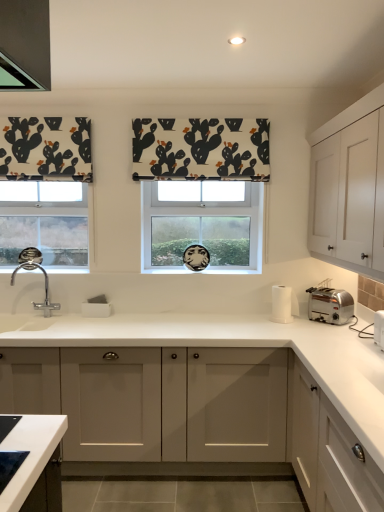
This screenshot has height=512, width=384. Identify the location of vacant area situated below chrome metallic sink at left (from a real-world perspective). (41, 314).